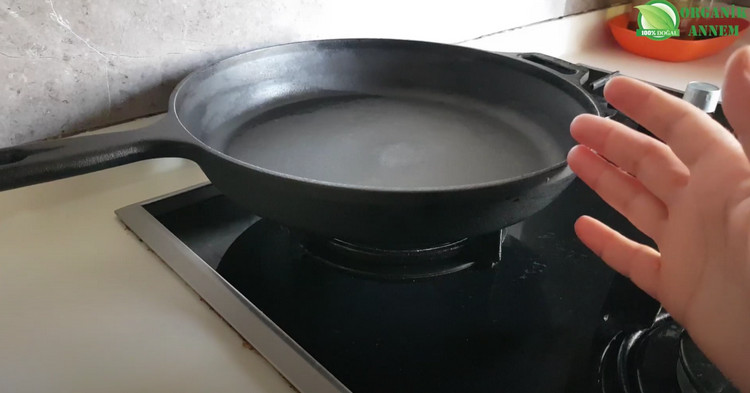
This screenshot has height=393, width=750. What are the coordinates of `cast iron skillet on back burner` in the screenshot? It's located at (346, 138), (424, 137).